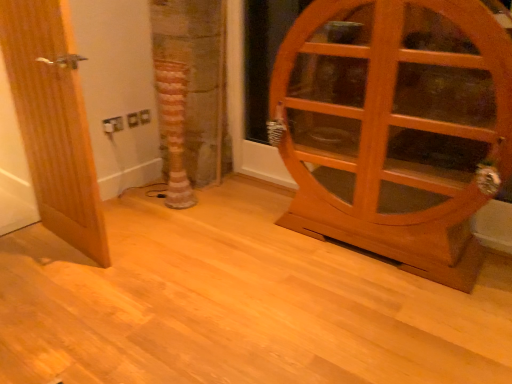
Where is `vacant region in front of wooden cabinet at right, acting as the 1th door starting from the right`? The height and width of the screenshot is (384, 512). vacant region in front of wooden cabinet at right, acting as the 1th door starting from the right is located at coordinates (375, 314).